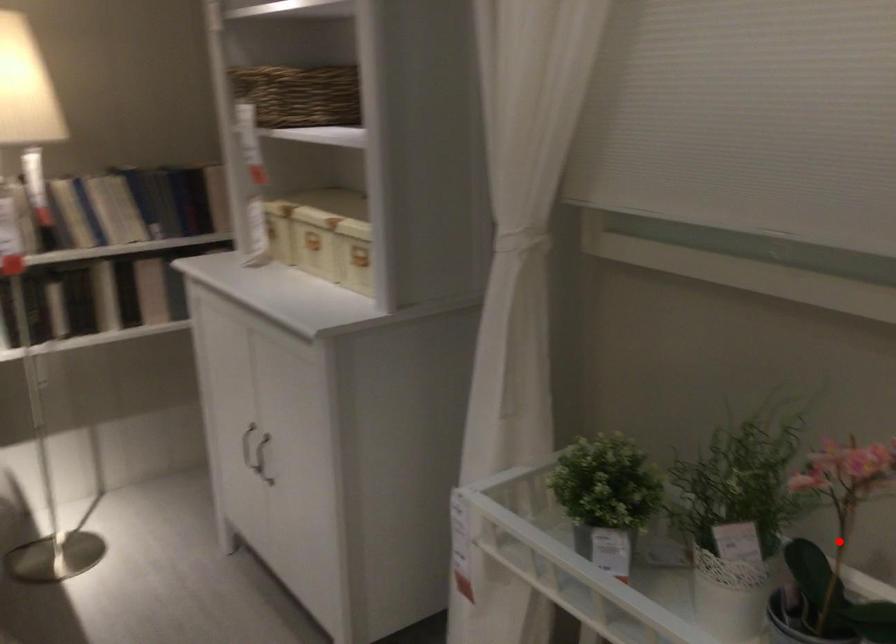
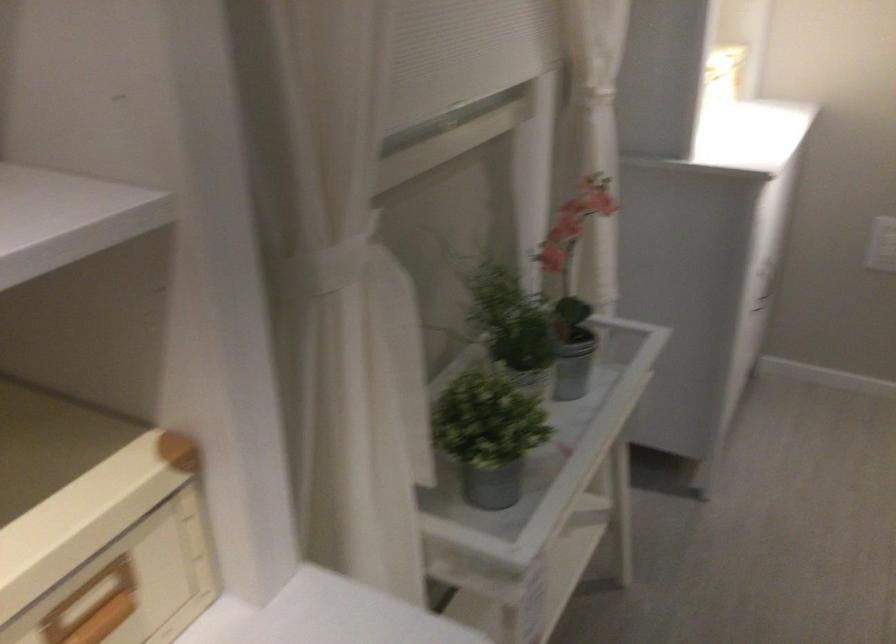
Question: I am providing you with two images of the same scene from different viewpoints. A red point is marked on the first image. At the location where the point appears in image 1, is it still visible in image 2?

Choices:
 (A) Yes
 (B) No

Answer: (B)